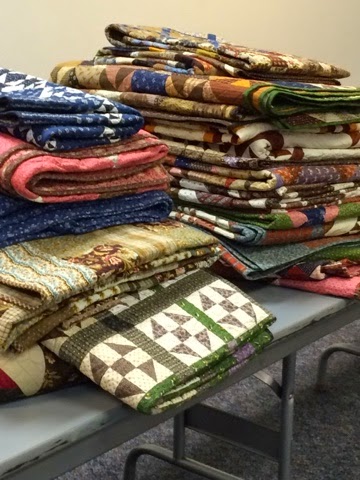
You are a GUI agent. You are given a task and a screenshot of the screen. Output one action in this format:
    pyautogui.click(x=<x>, y=<y>)
    Task: Click on the red blanket on right side of image
    Image resolution: width=360 pixels, height=480 pixels.
    Given the screenshot: What is the action you would take?
    pyautogui.click(x=341, y=284)